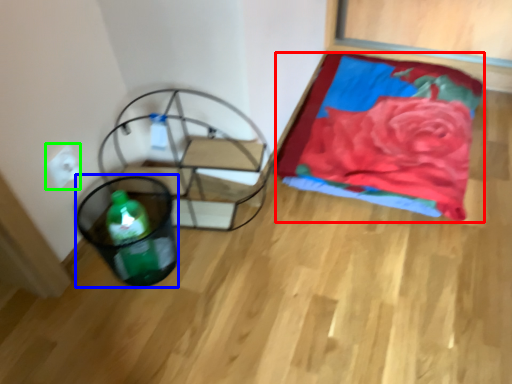
Question: Which object is the closest to the blanket (highlighted by a red box)? Choose among these: basket (highlighted by a blue box) or electric outlet (highlighted by a green box).

Choices:
 (A) basket
 (B) electric outlet

Answer: (A)